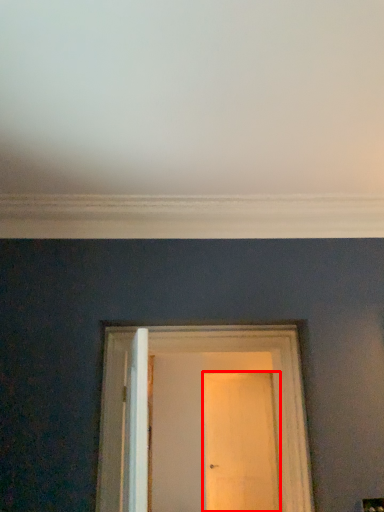
Question: Where is door (annotated by the red box) located in relation to door in the image?

Choices:
 (A) left
 (B) right

Answer: (B)